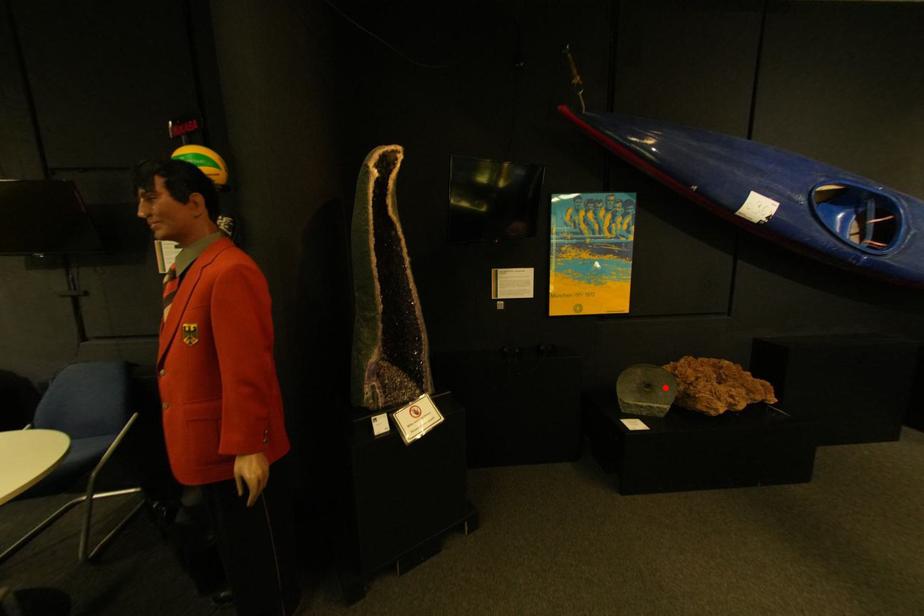
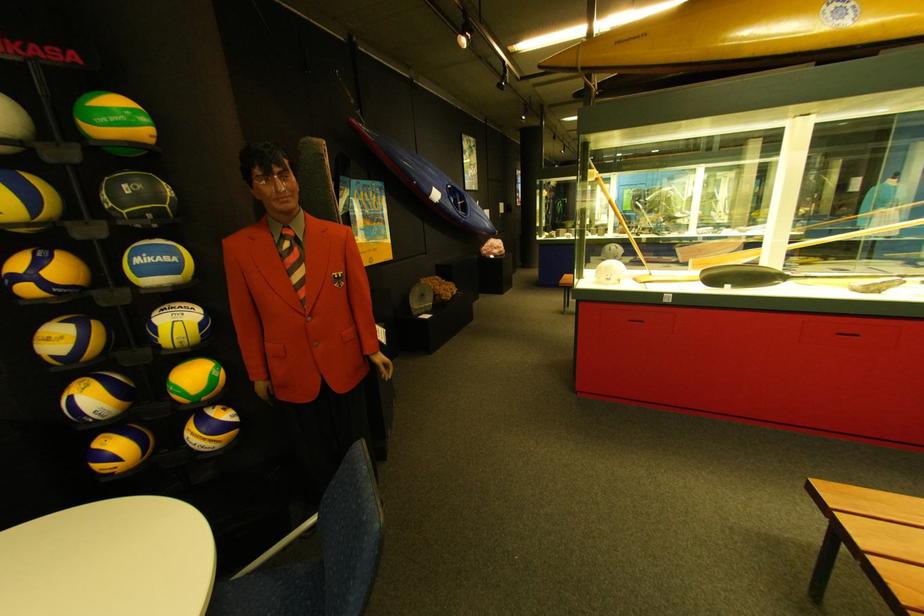
The point at the highlighted location is marked in the first image. Where is the corresponding point in the second image?

(438, 297)